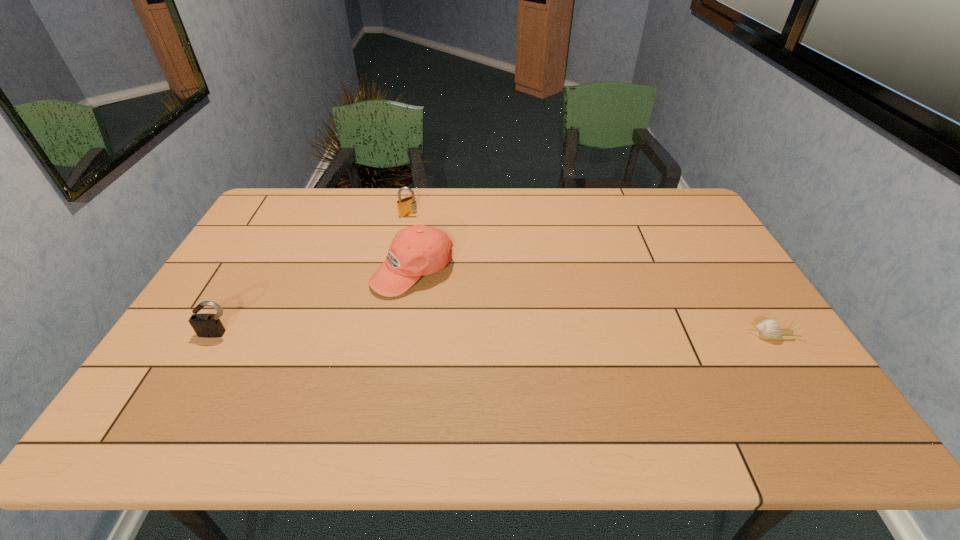
What are the coordinates of `object located in the right edge section of the desktop` in the screenshot? It's located at 767,329.

In the image, there is a desktop. Where is `vacant space at the far edge`? This screenshot has height=540, width=960. vacant space at the far edge is located at coordinates (473, 207).

The width and height of the screenshot is (960, 540). Find the location of `vacant space at the left edge of the desktop`. vacant space at the left edge of the desktop is located at coordinates (256, 230).

Where is `vacant region at the right edge of the desktop`? This screenshot has height=540, width=960. vacant region at the right edge of the desktop is located at coordinates (711, 315).

This screenshot has height=540, width=960. In order to click on free space at the far left corner of the desktop in this screenshot , I will do `click(289, 205)`.

The image size is (960, 540). Identify the location of vacant space at the near left corner of the desktop. click(146, 394).

Identify the location of empty space that is in between the second farthest object and the shortest object. Image resolution: width=960 pixels, height=540 pixels. (592, 303).

You are a GUI agent. You are given a task and a screenshot of the screen. Output one action in this format:
    pyautogui.click(x=<x>, y=<y>)
    Task: Click on the vacant space that's between the baseball cap and the leftmost object
    
    Given the screenshot: What is the action you would take?
    pyautogui.click(x=315, y=302)

You are a GUI agent. You are given a task and a screenshot of the screen. Output one action in this format:
    pyautogui.click(x=<x>, y=<y>)
    Task: Click on the blank region between the shortest object and the second farthest object
    This screenshot has height=540, width=960.
    Given the screenshot: What is the action you would take?
    pyautogui.click(x=592, y=303)

Where is `free space that is in between the leftmost object and the escargot`? free space that is in between the leftmost object and the escargot is located at coordinates (495, 334).